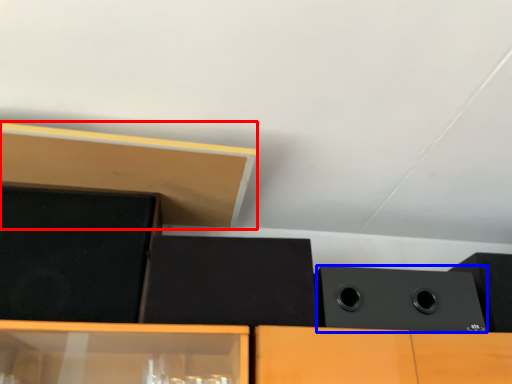
Question: Which object appears farthest to the camera in this image, wood (highlighted by a red box) or speaker (highlighted by a blue box)?

Choices:
 (A) wood
 (B) speaker

Answer: (B)